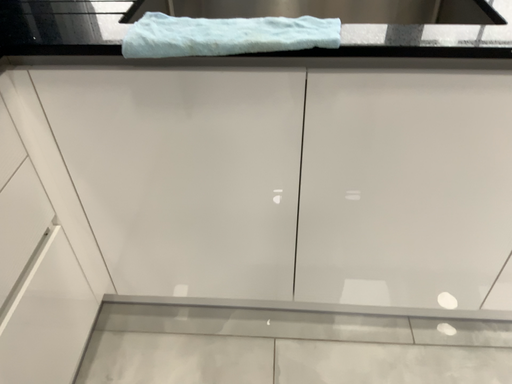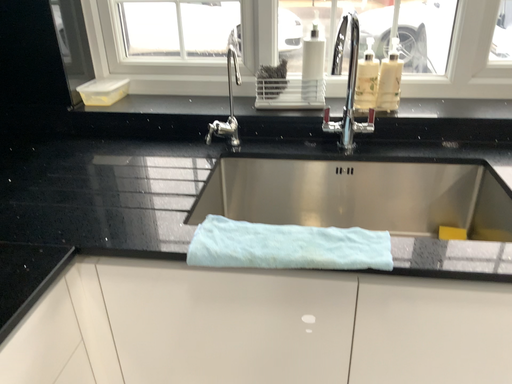
Question: Which way did the camera rotate in the video?

Choices:
 (A) rotated downward
 (B) rotated upward

Answer: (B)